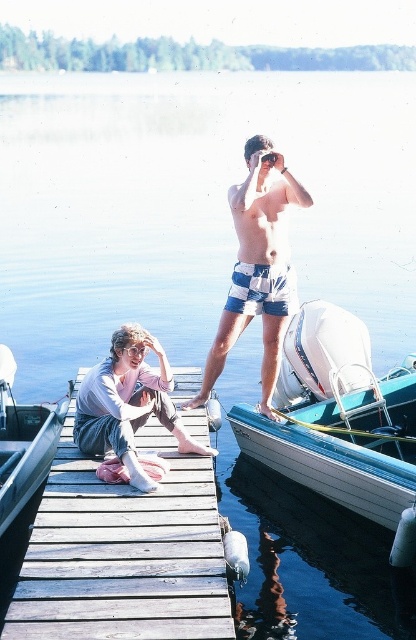
You are standing on the dock and want to board the white glossy boat at center. However, you need to pass by the striped swim trunks at center. Which object is closer to you, the boat or the swim trunks?

The white glossy boat at center is closer to you since it is in front of the striped swim trunks at center.

Based on the photo, you are planning to place a small potted plant between the wooden at center and the denim pants at center on the dock. Which object should the plant be closer to in order to maintain balance?

The plant should be placed closer to the wooden at center because it is shorter than the denim pants at center, so balancing the height difference would require positioning the plant nearer to the shorter object.

You are a photographer standing on the dock and want to take a picture of both the striped swim trunks at center and the denim pants at center in the same frame. If your camera has a 5 feet wide field of view, will both items fit in the photo?

The striped swim trunks at center and denim pants at center are 4.42 feet apart, so yes, both items will fit in the 5 feet wide field of view since the distance between them is less than the camera can capture.